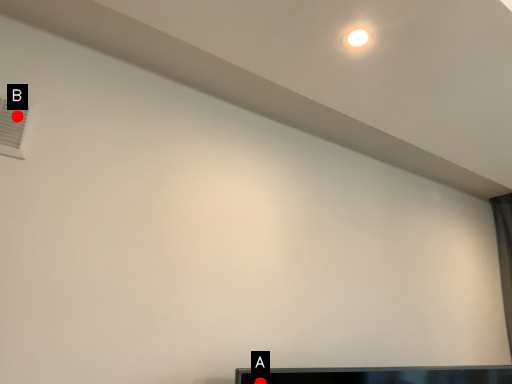
Question: Two points are circled on the image, labeled by A and B beside each circle. Among these points, which one is farthest from the camera?

Choices:
 (A) A is further
 (B) B is further

Answer: (A)